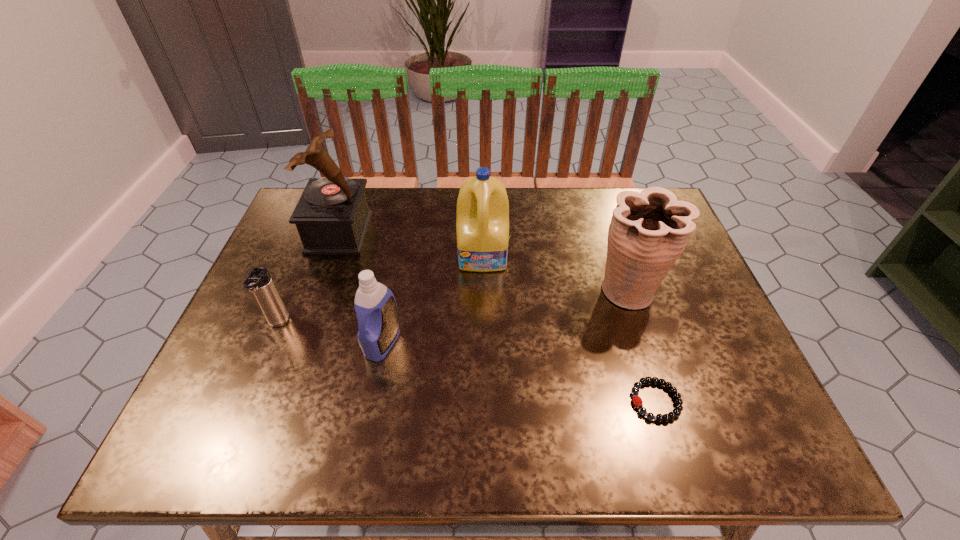
Identify the location of vacant area situated on the label of the farther detergent. (484, 311).

Locate an element on the screen. The image size is (960, 540). vacant space located 0.330m on the left of the urn is located at coordinates [461, 290].

You are a GUI agent. You are given a task and a screenshot of the screen. Output one action in this format:
    pyautogui.click(x=<x>, y=<y>)
    Task: Click on the free space located on the back of the nearer detergent
    The height and width of the screenshot is (540, 960).
    Given the screenshot: What is the action you would take?
    (401, 243)

Where is `free spot located on the handle side of the thermos bottle`? This screenshot has width=960, height=540. free spot located on the handle side of the thermos bottle is located at coordinates (241, 413).

The width and height of the screenshot is (960, 540). Identify the location of free space located 0.370m on the back of the shortest object. (612, 260).

Identify the location of object present at the far edge. The image size is (960, 540). (332, 216).

Identify the location of object located in the near edge section of the desktop. (676, 412).

Identify the location of phonograph_record that is at the left edge. (332, 216).

Image resolution: width=960 pixels, height=540 pixels. What are the coordinates of `thermos bottle positioned at the left edge` in the screenshot? It's located at (258, 281).

Identify the location of urn present at the right edge. (649, 230).